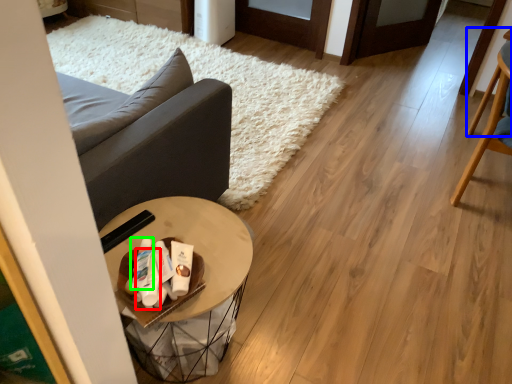
Question: Which object is the closest to the toiletry (highlighted by a red box)? Choose among these: chair (highlighted by a blue box) or toiletry (highlighted by a green box).

Choices:
 (A) chair
 (B) toiletry

Answer: (B)